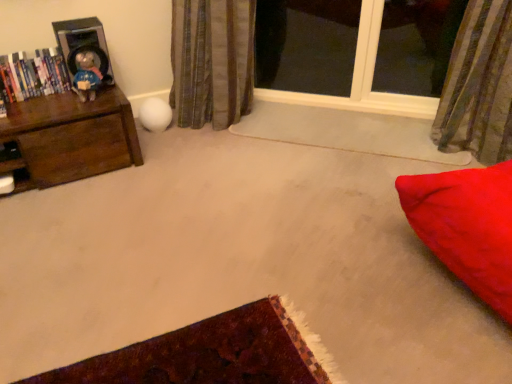
Question: Is metallic silver speaker at upper left inside or outside of brown wood chest of drawers at left?

Choices:
 (A) inside
 (B) outside

Answer: (B)

Question: Based on their positions, is metallic silver speaker at upper left located to the left or right of brown wood chest of drawers at left?

Choices:
 (A) left
 (B) right

Answer: (B)

Question: Considering the real-world distances, which object is farthest from the brown wood chest of drawers at left?

Choices:
 (A) striped fabric curtain at upper right, the 2th curtain in the left-to-right sequence
 (B) hardcover books at left
 (C) transparent glass window at upper center
 (D) white fabric curtain at upper left, the 1th curtain viewed from the left
 (E) matte plastic doll at left

Answer: (A)

Question: Which object is positioned closest to the transparent glass window at upper center?

Choices:
 (A) matte plastic doll at left
 (B) hardcover books at left
 (C) brown wood chest of drawers at left
 (D) white fabric curtain at upper left, placed as the second curtain when sorted from right to left
 (E) metallic silver speaker at upper left

Answer: (D)